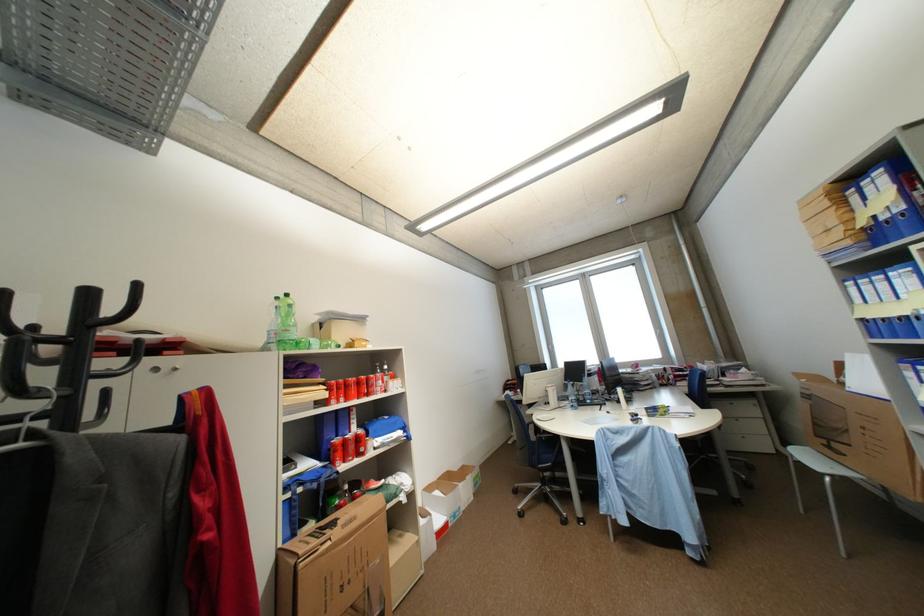
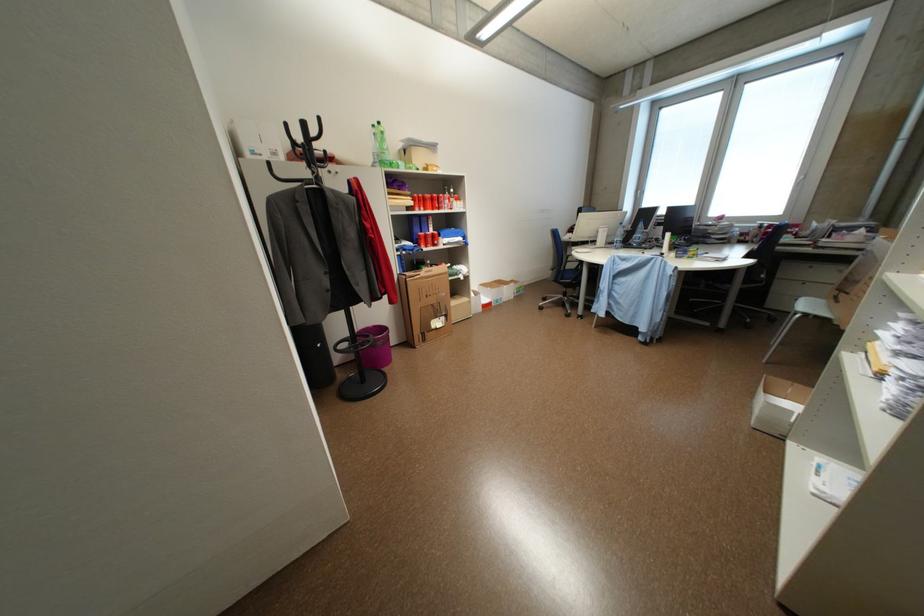
In the second image, find the point that corresponds to [336,551] in the first image.

(428, 280)